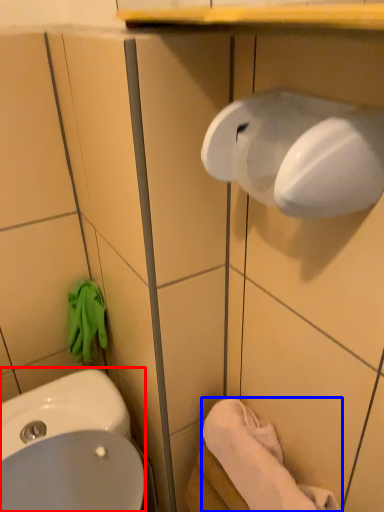
Question: Which of the following is the farthest to the observer, sink (highlighted by a red box) or towel/napkin (highlighted by a blue box)?

Choices:
 (A) sink
 (B) towel/napkin

Answer: (B)